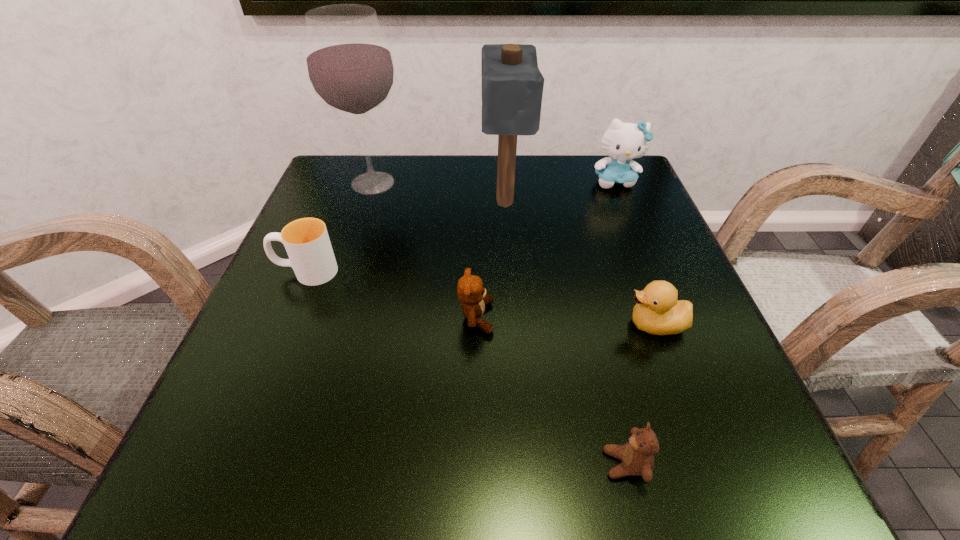
Where is `kitten that is at the far edge`? This screenshot has height=540, width=960. kitten that is at the far edge is located at coordinates (623, 142).

Image resolution: width=960 pixels, height=540 pixels. Identify the location of object present at the near edge. (637, 455).

Identify the location of alcohol located at the left edge. The width and height of the screenshot is (960, 540). pyautogui.click(x=350, y=67).

You are a GUI agent. You are given a task and a screenshot of the screen. Output one action in this format:
    pyautogui.click(x=<x>, y=<y>)
    Task: Click on the cup positioned at the left edge
    
    Given the screenshot: What is the action you would take?
    pyautogui.click(x=306, y=240)

Identify the location of kitten at the right edge. (623, 142).

At what (x,y) coordinates should I click in order to perform the action: click on duckling that is at the right edge. Please return your answer as a coordinate pair (x, y). This screenshot has height=540, width=960. Looking at the image, I should click on (657, 311).

Locate an element on the screen. object positioned at the far left corner is located at coordinates (350, 67).

This screenshot has height=540, width=960. I want to click on object located at the far right corner, so pyautogui.click(x=623, y=142).

Identify the location of free space at the far edge. The height and width of the screenshot is (540, 960). (402, 191).

This screenshot has width=960, height=540. In the image, there is a desktop. In order to click on vacant space at the near edge in this screenshot , I will do `click(632, 498)`.